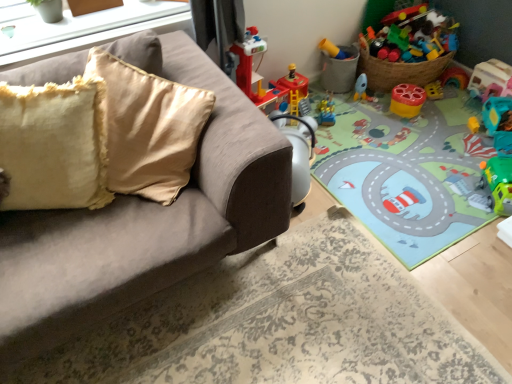
In order to click on free space on the front side of matte plastic bucket at upper right, which is the 2th toy from left to right in this screenshot , I will do `click(344, 102)`.